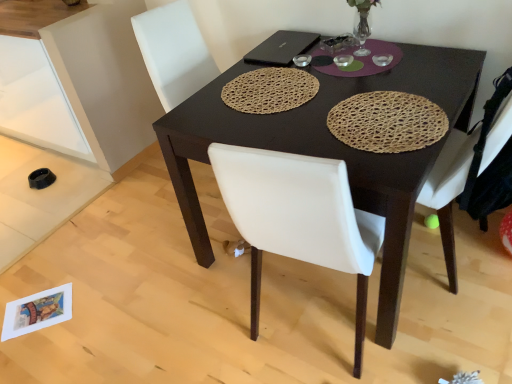
This screenshot has height=384, width=512. Find the location of `vacant space situated on the left part of dark brown wooden desk at center`. vacant space situated on the left part of dark brown wooden desk at center is located at coordinates (146, 279).